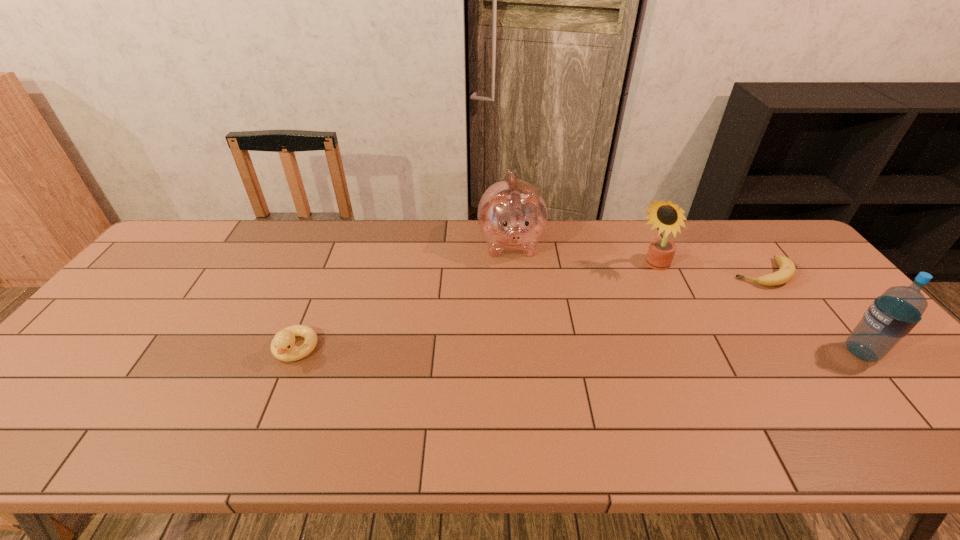
Point out which object is positioned as the nearest to the shortest object. Please provide its 2D coordinates. Your answer should be formatted as a tuple, i.e. [(x, y)], where the tuple contains the x and y coordinates of a point satisfying the conditions above.

[(667, 216)]

Where is `free spot that satisfies the following two spatial constraints: 1. on the front side of the third object from right to left; 2. on the right side of the fourth object from right to left`? free spot that satisfies the following two spatial constraints: 1. on the front side of the third object from right to left; 2. on the right side of the fourth object from right to left is located at coordinates coord(513,268).